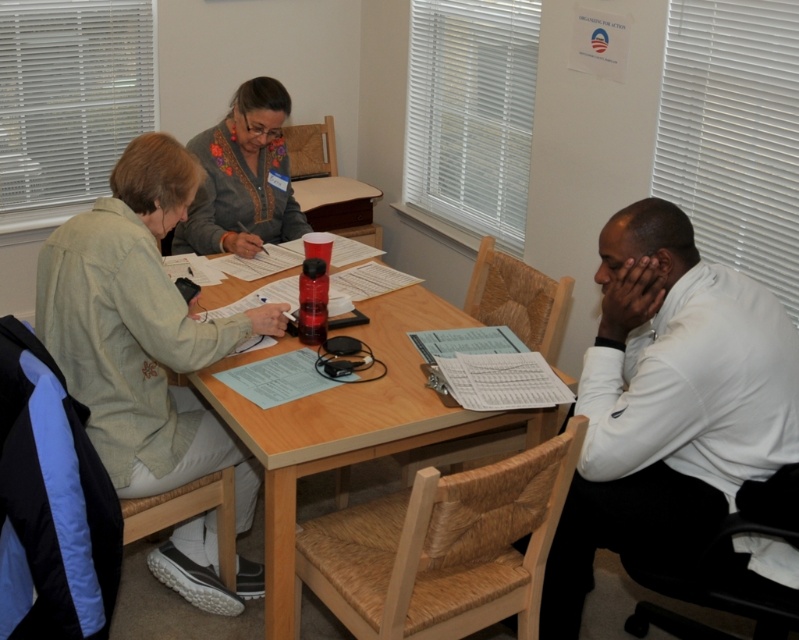
Question: Which object is closer to the camera taking this photo?

Choices:
 (A) white shirt at right
 (B) knitted gray sweater at center

Answer: (A)

Question: Is white shirt at right closer to camera compared to wooden table at center?

Choices:
 (A) yes
 (B) no

Answer: (A)

Question: Does wooden table at center come in front of knitted gray sweater at center?

Choices:
 (A) yes
 (B) no

Answer: (A)

Question: Which point is closer to the camera?

Choices:
 (A) (364, 333)
 (B) (758, 401)
 (C) (253, 145)

Answer: (B)

Question: Which point is closer to the camera?

Choices:
 (A) (285, 104)
 (B) (638, 548)

Answer: (B)

Question: Is white shirt at right bigger than wooden table at center?

Choices:
 (A) no
 (B) yes

Answer: (A)